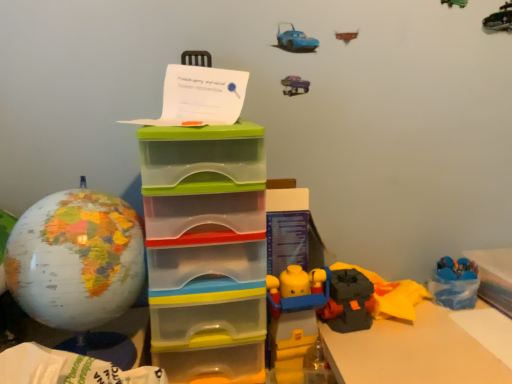
Question: From the image's perspective, is blue plastic storage box at lower right, which ranks as the 2th storage box in left-to-right order, located above or below matte globe at left?

Choices:
 (A) above
 (B) below

Answer: (B)

Question: Is point (509, 294) closer or farther from the camera than point (24, 266)?

Choices:
 (A) farther
 (B) closer

Answer: (A)

Question: Based on their relative distances, which object is nearer to the matte globe at left?

Choices:
 (A) blue plastic storage box at lower right, which ranks as the first storage box in right-to-left order
 (B) translucent plastic storage box at center, the second storage box when ordered from right to left

Answer: (B)

Question: Which object is positioned closest to the matte globe at left?

Choices:
 (A) translucent plastic storage box at center, arranged as the 1th storage box when viewed from the left
 (B) blue plastic storage box at lower right, which ranks as the first storage box in right-to-left order

Answer: (A)